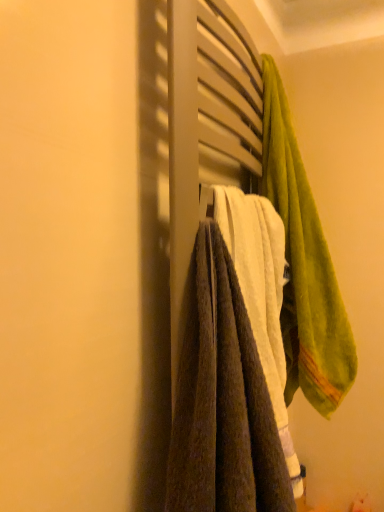
Question: Can you confirm if green soft towel at upper right, which is counted as the first towel, starting from the right, is taller than brown textured towel at center, which is the 2th towel from right to left?

Choices:
 (A) yes
 (B) no

Answer: (A)

Question: From a real-world perspective, is green soft towel at upper right, the second towel viewed from the left, physically above brown textured towel at center, which is the 2th towel from right to left?

Choices:
 (A) no
 (B) yes

Answer: (B)

Question: Is green soft towel at upper right, which is counted as the first towel, starting from the right, oriented away from brown textured towel at center, the first towel positioned from the left?

Choices:
 (A) no
 (B) yes

Answer: (A)

Question: Does green soft towel at upper right, which is counted as the first towel, starting from the right, have a lesser width compared to brown textured towel at center, the first towel positioned from the left?

Choices:
 (A) no
 (B) yes

Answer: (A)

Question: Is green soft towel at upper right, which is counted as the first towel, starting from the right, behind brown textured towel at center, which is the 2th towel from right to left?

Choices:
 (A) no
 (B) yes

Answer: (B)

Question: Is green soft towel at upper right, the second towel viewed from the left, with brown textured towel at center, the first towel positioned from the left?

Choices:
 (A) no
 (B) yes

Answer: (A)

Question: Does brown textured towel at center, the first towel positioned from the left, have a lesser height compared to green soft towel at upper right, the second towel viewed from the left?

Choices:
 (A) yes
 (B) no

Answer: (A)

Question: Does brown textured towel at center, which is the 2th towel from right to left, have a greater width compared to green soft towel at upper right, the second towel viewed from the left?

Choices:
 (A) yes
 (B) no

Answer: (B)

Question: Is brown textured towel at center, which is the 2th towel from right to left, to the left of green soft towel at upper right, the second towel viewed from the left, from the viewer's perspective?

Choices:
 (A) no
 (B) yes

Answer: (B)

Question: Is brown textured towel at center, which is the 2th towel from right to left, smaller than green soft towel at upper right, which is counted as the first towel, starting from the right?

Choices:
 (A) yes
 (B) no

Answer: (A)

Question: From a real-world perspective, is brown textured towel at center, which is the 2th towel from right to left, below green soft towel at upper right, the second towel viewed from the left?

Choices:
 (A) no
 (B) yes

Answer: (B)

Question: From the image's perspective, is brown textured towel at center, the first towel positioned from the left, on green soft towel at upper right, which is counted as the first towel, starting from the right?

Choices:
 (A) yes
 (B) no

Answer: (B)

Question: From the image's perspective, is brown textured towel at center, the first towel positioned from the left, positioned above or below green soft towel at upper right, the second towel viewed from the left?

Choices:
 (A) above
 (B) below

Answer: (B)